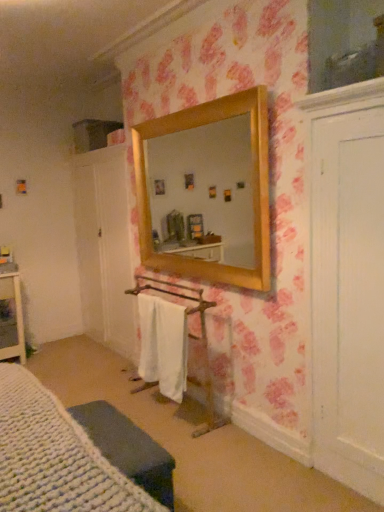
Question: Is knitted fabric cushion at lower left to the right of white knitted bed at lower left from the viewer's perspective?

Choices:
 (A) yes
 (B) no

Answer: (A)

Question: Is there a large distance between knitted fabric cushion at lower left and white knitted bed at lower left?

Choices:
 (A) no
 (B) yes

Answer: (A)

Question: Does knitted fabric cushion at lower left lie in front of white knitted bed at lower left?

Choices:
 (A) no
 (B) yes

Answer: (A)

Question: From a real-world perspective, is knitted fabric cushion at lower left below white knitted bed at lower left?

Choices:
 (A) no
 (B) yes

Answer: (B)

Question: From a real-world perspective, is knitted fabric cushion at lower left on top of white knitted bed at lower left?

Choices:
 (A) no
 (B) yes

Answer: (A)

Question: Does point (16, 501) appear closer or farther from the camera than point (147, 322)?

Choices:
 (A) closer
 (B) farther

Answer: (A)

Question: Is white knitted bed at lower left inside the boundaries of white cotton bath towel at center, or outside?

Choices:
 (A) outside
 (B) inside

Answer: (A)

Question: Is white knitted bed at lower left wider or thinner than white cotton bath towel at center?

Choices:
 (A) wide
 (B) thin

Answer: (A)

Question: Is white knitted bed at lower left bigger or smaller than white cotton bath towel at center?

Choices:
 (A) small
 (B) big

Answer: (B)

Question: Considering their positions, is white cotton bath towel at center located in front of or behind knitted fabric cushion at lower left?

Choices:
 (A) front
 (B) behind

Answer: (B)

Question: Is white cotton bath towel at center inside or outside of knitted fabric cushion at lower left?

Choices:
 (A) inside
 (B) outside

Answer: (B)

Question: In terms of width, does white cotton bath towel at center look wider or thinner when compared to knitted fabric cushion at lower left?

Choices:
 (A) wide
 (B) thin

Answer: (B)

Question: Is point (162, 303) positioned closer to the camera than point (135, 425)?

Choices:
 (A) farther
 (B) closer

Answer: (A)

Question: Considering their positions, is white cotton bath towel at center located in front of or behind white knitted bed at lower left?

Choices:
 (A) behind
 (B) front

Answer: (A)

Question: Is point (150, 330) closer or farther from the camera than point (11, 420)?

Choices:
 (A) closer
 (B) farther

Answer: (B)